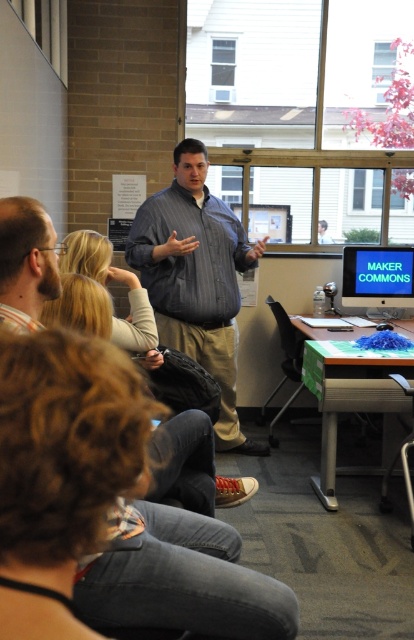
Question: Which object is positioned farthest from the striped shirt at center?

Choices:
 (A) green fabric-covered table at lower right
 (B) blue glossy monitor at center-right
 (C) beige fabric shirt at upper left

Answer: (C)

Question: Is striped shirt at center bigger than blue glossy monitor at center-right?

Choices:
 (A) no
 (B) yes

Answer: (B)

Question: Which of the following is the closest to the observer?

Choices:
 (A) green fabric-covered table at lower right
 (B) beige fabric shirt at upper left
 (C) blue glossy monitor at center-right
 (D) striped shirt at center

Answer: (B)

Question: Can you confirm if green fabric-covered table at lower right is positioned to the left of beige fabric shirt at upper left?

Choices:
 (A) no
 (B) yes

Answer: (A)

Question: Can you confirm if green fabric-covered table at lower right is positioned to the right of beige fabric shirt at upper left?

Choices:
 (A) no
 (B) yes

Answer: (B)

Question: Which of the following is the farthest from the observer?

Choices:
 (A) striped shirt at center
 (B) blue glossy monitor at center-right
 (C) beige fabric shirt at upper left

Answer: (B)